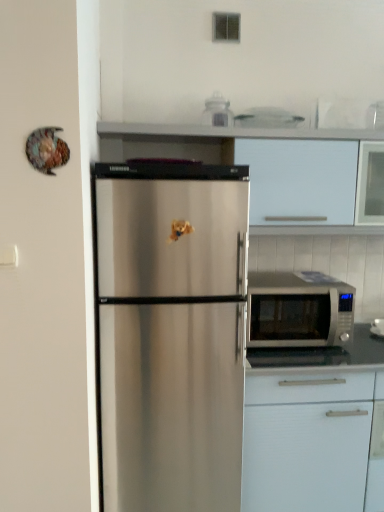
What do you see at coordinates (251, 162) in the screenshot? The image size is (384, 512). I see `white matte cabinet at upper center, the first cabinetry viewed from the top` at bounding box center [251, 162].

The image size is (384, 512). In order to click on white matte cabinet at lower right, the second cabinetry from the top in this screenshot , I will do `click(315, 428)`.

Is there a large distance between white matte cabinet at upper center, the first cabinetry viewed from the top, and silver metallic microwave at right?

white matte cabinet at upper center, the first cabinetry viewed from the top, is actually quite close to silver metallic microwave at right.

Considering the points (321, 133) and (300, 342), which point is in front, point (321, 133) or point (300, 342)?

The point (300, 342) is more forward.

Does white matte cabinet at upper center, the first cabinetry viewed from the top, have a smaller size compared to silver metallic microwave at right?

Incorrect, white matte cabinet at upper center, the first cabinetry viewed from the top, is not smaller in size than silver metallic microwave at right.

Considering the relative positions of white matte cabinet at upper center, the first cabinetry viewed from the top, and silver metallic microwave at right in the image provided, is white matte cabinet at upper center, the first cabinetry viewed from the top, in front of silver metallic microwave at right?

Yes, it is in front of silver metallic microwave at right.

Considering the positions of objects white matte cabinet at lower right, acting as the 1th cabinetry starting from the bottom, and silver metallic microwave at right in the image provided, who is more to the right, white matte cabinet at lower right, acting as the 1th cabinetry starting from the bottom, or silver metallic microwave at right?

From the viewer's perspective, white matte cabinet at lower right, acting as the 1th cabinetry starting from the bottom, appears more on the right side.

From the picture: Considering their positions, is white matte cabinet at lower right, acting as the 1th cabinetry starting from the bottom, located in front of or behind silver metallic microwave at right?

In the image, white matte cabinet at lower right, acting as the 1th cabinetry starting from the bottom, appears in front of silver metallic microwave at right.

From a real-world perspective, relative to silver metallic microwave at right, is white matte cabinet at lower right, acting as the 1th cabinetry starting from the bottom, vertically above or below?

From a real-world perspective, white matte cabinet at lower right, acting as the 1th cabinetry starting from the bottom, is physically below silver metallic microwave at right.

In terms of height, does white matte cabinet at lower right, the second cabinetry from the top, look taller or shorter compared to silver metallic microwave at right?

In the image, white matte cabinet at lower right, the second cabinetry from the top, appears to be taller than silver metallic microwave at right.

From the image's perspective, is silver metallic microwave at right positioned above or below white matte cabinet at lower right, acting as the 1th cabinetry starting from the bottom?

Clearly, from the image's perspective, silver metallic microwave at right is above white matte cabinet at lower right, acting as the 1th cabinetry starting from the bottom.

Which is behind, silver metallic microwave at right or white matte cabinet at lower right, acting as the 1th cabinetry starting from the bottom?

silver metallic microwave at right is behind.

From a real-world perspective, is silver metallic microwave at right beneath white matte cabinet at lower right, acting as the 1th cabinetry starting from the bottom?

Incorrect, from a real-world perspective, silver metallic microwave at right is higher than white matte cabinet at lower right, acting as the 1th cabinetry starting from the bottom.

Considering the relative sizes of silver metallic microwave at right and white matte cabinet at lower right, the second cabinetry from the top, in the image provided, is silver metallic microwave at right bigger than white matte cabinet at lower right, the second cabinetry from the top,?

Incorrect, silver metallic microwave at right is not larger than white matte cabinet at lower right, the second cabinetry from the top.

From the image's perspective, which object appears higher, white matte cabinet at lower right, acting as the 1th cabinetry starting from the bottom, or white matte cabinet at upper center, the first cabinetry viewed from the top?

white matte cabinet at upper center, the first cabinetry viewed from the top, appears higher in the image.

Which object is thinner, white matte cabinet at lower right, the second cabinetry from the top, or white matte cabinet at upper center, placed as the second cabinetry when sorted from bottom to top?

Thinner between the two is white matte cabinet at upper center, placed as the second cabinetry when sorted from bottom to top.

Which is more to the left, white matte cabinet at lower right, the second cabinetry from the top, or white matte cabinet at upper center, the first cabinetry viewed from the top?

white matte cabinet at upper center, the first cabinetry viewed from the top, is more to the left.

Would you say white matte cabinet at lower right, acting as the 1th cabinetry starting from the bottom, contains white matte cabinet at upper center, placed as the second cabinetry when sorted from bottom to top?

Definitely not — white matte cabinet at upper center, placed as the second cabinetry when sorted from bottom to top, is not inside white matte cabinet at lower right, acting as the 1th cabinetry starting from the bottom.

Is the position of silver metallic microwave at right more distant than that of white matte cabinet at upper center, the first cabinetry viewed from the top?

Yes, silver metallic microwave at right is behind white matte cabinet at upper center, the first cabinetry viewed from the top.

Would you say silver metallic microwave at right is outside white matte cabinet at upper center, placed as the second cabinetry when sorted from bottom to top?

Indeed, silver metallic microwave at right is completely outside white matte cabinet at upper center, placed as the second cabinetry when sorted from bottom to top.

From the image's perspective, is silver metallic microwave at right located above or below white matte cabinet at upper center, the first cabinetry viewed from the top?

From the image's perspective, silver metallic microwave at right appears below white matte cabinet at upper center, the first cabinetry viewed from the top.

From a real-world perspective, is white matte cabinet at upper center, the first cabinetry viewed from the top, above or below white matte cabinet at lower right, acting as the 1th cabinetry starting from the bottom?

In terms of real-world spatial position, white matte cabinet at upper center, the first cabinetry viewed from the top, is above white matte cabinet at lower right, acting as the 1th cabinetry starting from the bottom.

From the image's perspective, who appears lower, white matte cabinet at upper center, the first cabinetry viewed from the top, or white matte cabinet at lower right, acting as the 1th cabinetry starting from the bottom?

From the image's view, white matte cabinet at lower right, acting as the 1th cabinetry starting from the bottom, is below.

Is point (303, 231) less distant than point (372, 502)?

That is False.

Is white matte cabinet at upper center, the first cabinetry viewed from the top, facing away from white matte cabinet at lower right, acting as the 1th cabinetry starting from the bottom?

white matte cabinet at upper center, the first cabinetry viewed from the top, does not have its back to white matte cabinet at lower right, acting as the 1th cabinetry starting from the bottom.

I want to click on microwave oven behind the white matte cabinet at upper center, placed as the second cabinetry when sorted from bottom to top, so click(298, 311).

The height and width of the screenshot is (512, 384). I want to click on microwave oven that appears above the white matte cabinet at lower right, acting as the 1th cabinetry starting from the bottom (from a real-world perspective), so click(298, 311).

Estimate the real-world distances between objects in this image. Which object is closer to white matte cabinet at upper center, the first cabinetry viewed from the top, silver metallic microwave at right or white matte cabinet at lower right, acting as the 1th cabinetry starting from the bottom?

The object closer to white matte cabinet at upper center, the first cabinetry viewed from the top, is silver metallic microwave at right.

Based on their spatial positions, is white matte cabinet at upper center, placed as the second cabinetry when sorted from bottom to top, or silver metallic microwave at right further from white matte cabinet at lower right, the second cabinetry from the top?

Among the two, white matte cabinet at upper center, placed as the second cabinetry when sorted from bottom to top, is located further to white matte cabinet at lower right, the second cabinetry from the top.

Estimate the real-world distances between objects in this image. Which object is closer to silver metallic microwave at right, white matte cabinet at upper center, placed as the second cabinetry when sorted from bottom to top, or white matte cabinet at lower right, the second cabinetry from the top?

Among the two, white matte cabinet at lower right, the second cabinetry from the top, is located nearer to silver metallic microwave at right.

From the image, which object appears to be farther from white matte cabinet at lower right, the second cabinetry from the top, silver metallic microwave at right or white matte cabinet at upper center, placed as the second cabinetry when sorted from bottom to top?

white matte cabinet at upper center, placed as the second cabinetry when sorted from bottom to top.

From the image, which object appears to be farther from white matte cabinet at upper center, placed as the second cabinetry when sorted from bottom to top, white matte cabinet at lower right, acting as the 1th cabinetry starting from the bottom, or silver metallic microwave at right?

white matte cabinet at lower right, acting as the 1th cabinetry starting from the bottom, is further to white matte cabinet at upper center, placed as the second cabinetry when sorted from bottom to top.

Looking at this image, looking at the image, which one is located closer to silver metallic microwave at right, white matte cabinet at lower right, the second cabinetry from the top, or white matte cabinet at upper center, placed as the second cabinetry when sorted from bottom to top?

white matte cabinet at lower right, the second cabinetry from the top, is closer to silver metallic microwave at right.

Locate an element on the screen. microwave oven between white matte cabinet at upper center, placed as the second cabinetry when sorted from bottom to top, and white matte cabinet at lower right, the second cabinetry from the top, in the vertical direction is located at coordinates (298, 311).